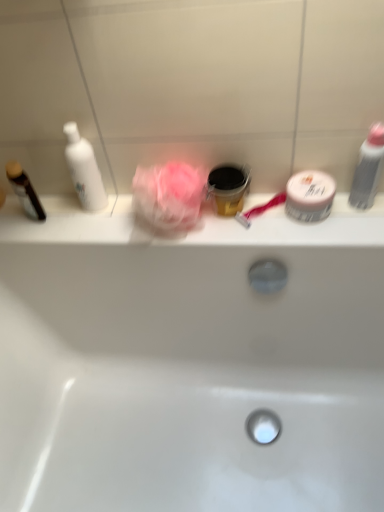
Where is `free space to the left of white glossy bottle at left`? The height and width of the screenshot is (512, 384). free space to the left of white glossy bottle at left is located at coordinates (47, 217).